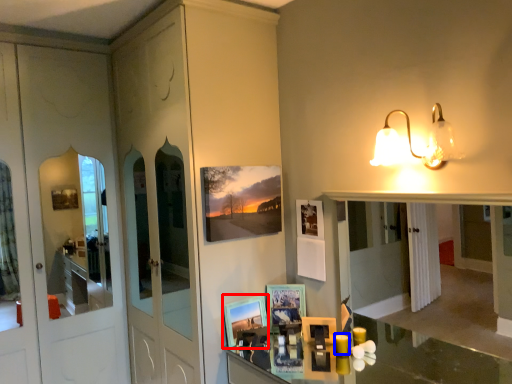
Question: Which object is closer to the camera taking this photo, picture frame (highlighted by a red box) or candle (highlighted by a blue box)?

Choices:
 (A) picture frame
 (B) candle

Answer: (B)